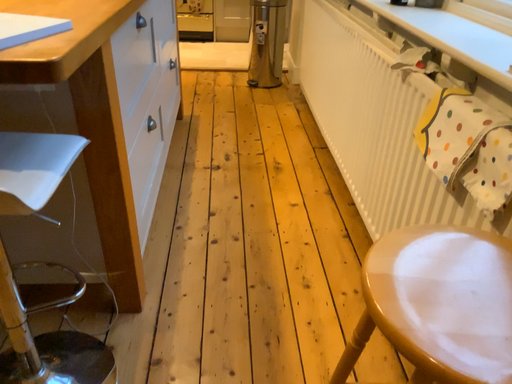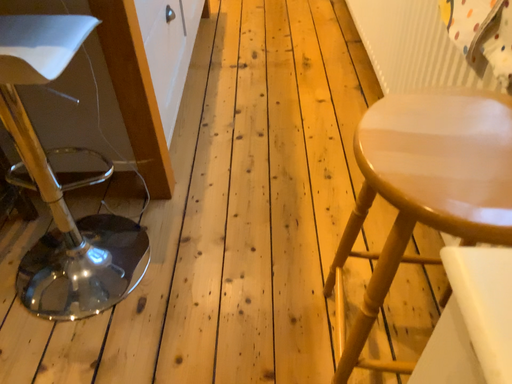
Question: How did the camera likely rotate when shooting the video?

Choices:
 (A) rotated downward
 (B) rotated upward

Answer: (A)